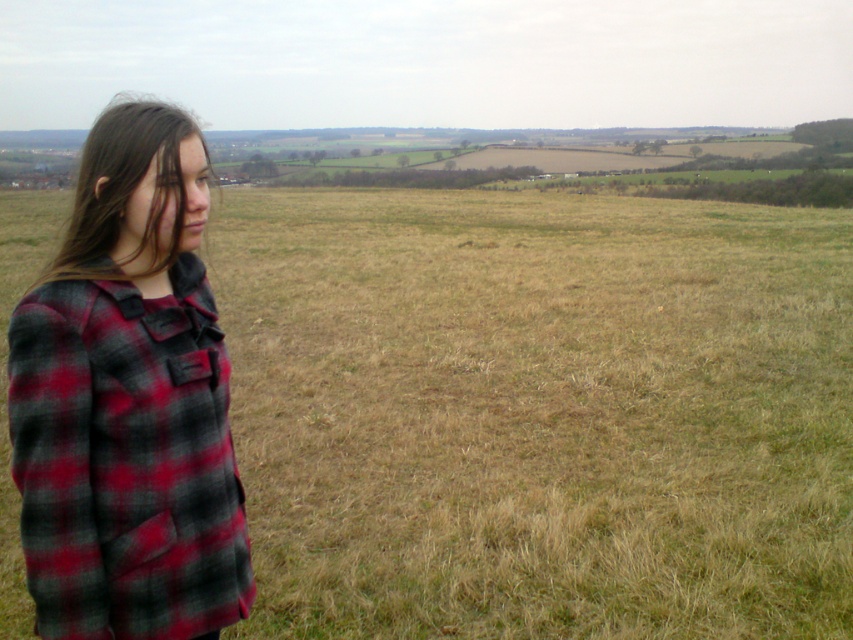
Is brown dry grass at left shorter than red plaid jacket at left?

No, brown dry grass at left is not shorter than red plaid jacket at left.

Can you confirm if brown dry grass at left is taller than red plaid jacket at left?

Indeed, brown dry grass at left has a greater height compared to red plaid jacket at left.

The image size is (853, 640). Find the location of `brown dry grass at left`. brown dry grass at left is located at coordinates (538, 412).